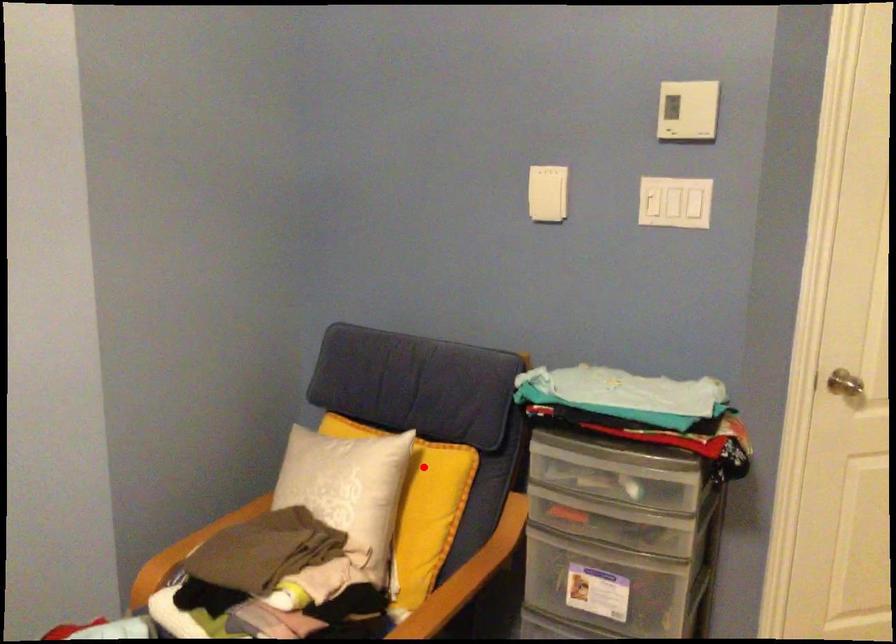
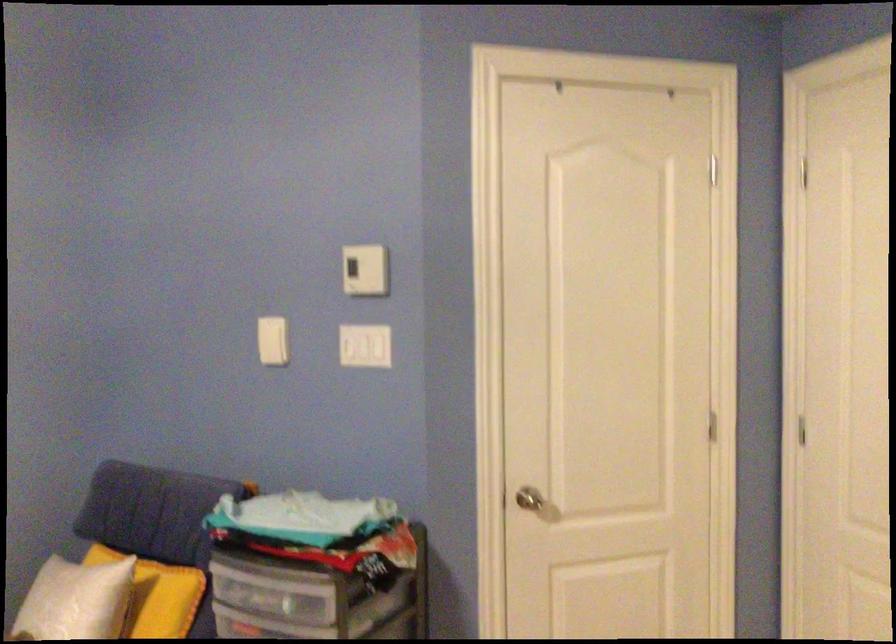
Where in the second image is the point corresponding to the highlighted location from the first image?

(157, 594)